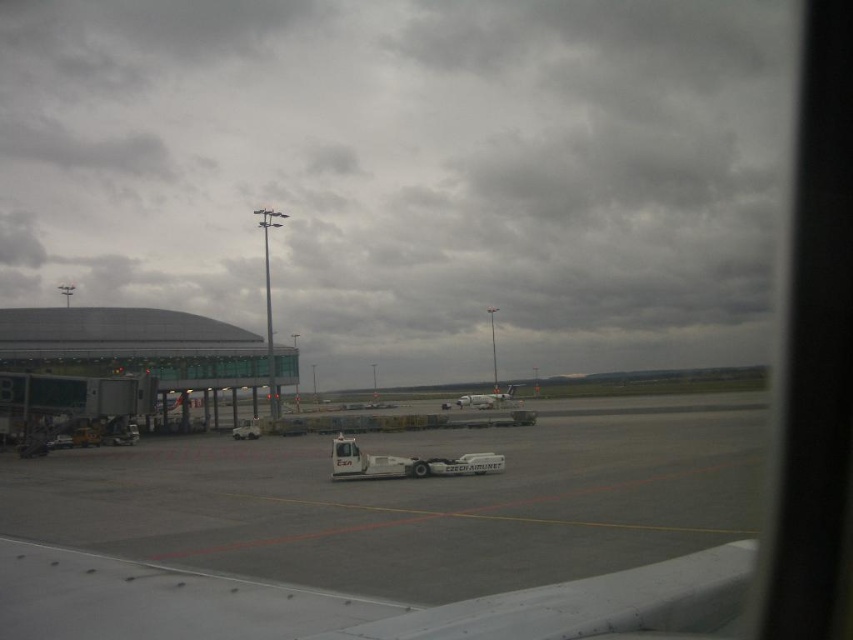
Does white rubber tarmac at center appear on the left side of white matte airplane at center?

Yes, white rubber tarmac at center is to the left of white matte airplane at center.

Is white rubber tarmac at center taller than white matte airplane at center?

Yes.

This screenshot has height=640, width=853. Identify the location of white rubber tarmac at center. (x=390, y=531).

Does point (170, 314) lie in front of point (451, 406)?

Yes, it is.

Between transparent glass terminal at left and white matte airplane at center, which one appears on the left side from the viewer's perspective?

transparent glass terminal at left

You are a GUI agent. You are given a task and a screenshot of the screen. Output one action in this format:
    pyautogui.click(x=<x>, y=<y>)
    Task: Click on the transparent glass terminal at left
    This screenshot has height=640, width=853.
    Given the screenshot: What is the action you would take?
    pyautogui.click(x=126, y=364)

Measure the distance between point (662, 545) and camera.

Point (662, 545) and camera are 33.32 feet apart.

Which is below, white rubber tarmac at center or transparent glass terminal at left?

white rubber tarmac at center is below.

Does point (312, 516) come farther from viewer compared to point (57, 349)?

No, it is not.

Locate an element on the screen. white rubber tarmac at center is located at coordinates (390, 531).